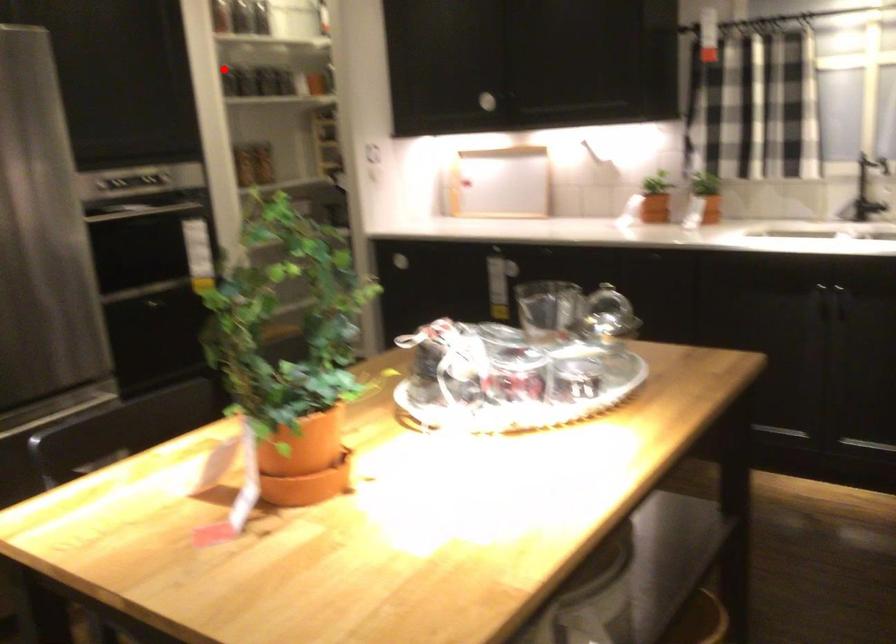
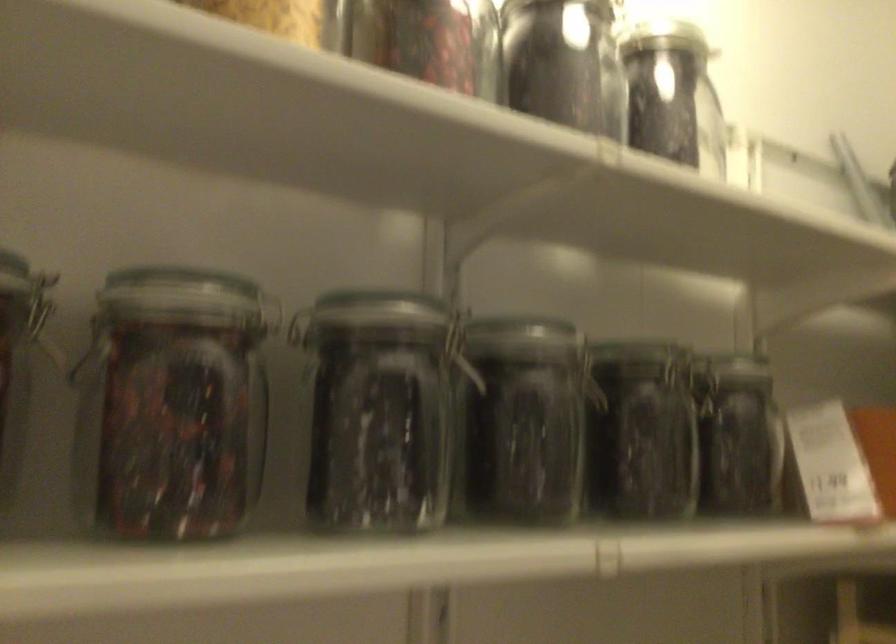
Where in the second image is the point corresponding to the highlighted location from the first image?

(376, 410)